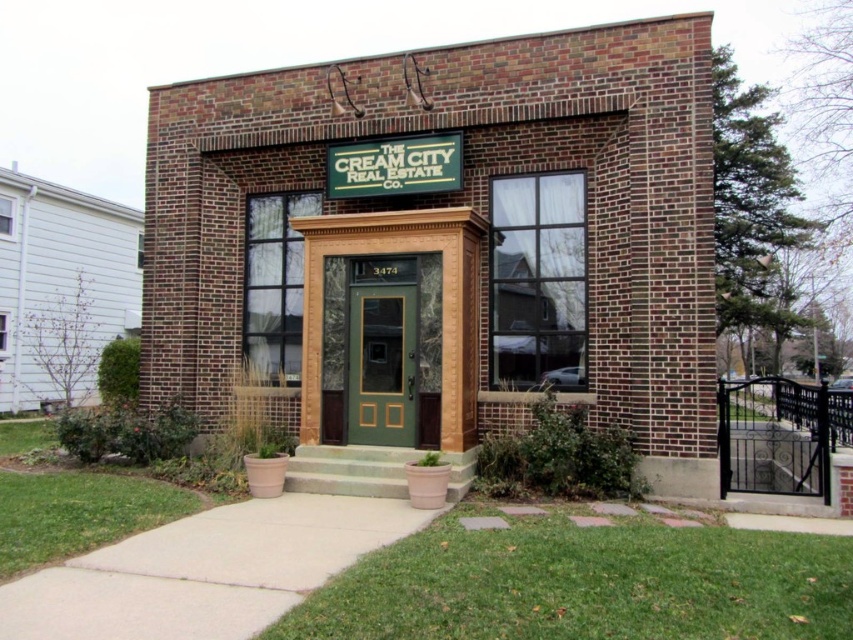
You are a delivery person trying to deliver a package to the green marble door at center and the green matte door at center. However, you notice that there are two doors with similar colors. How can you distinguish between the two doors?

The green marble door at center is much taller than the green matte door at center, so you can tell them apart by their height difference.

You are a delivery person with a package that requires a 10 cm clearance to pass through the entrance. You see the green marble door at center and the green matte door at center. Can you fit through the space between them?

The green marble door at center and the green matte door at center are 7.10 centimeters apart from each other. Since the required clearance is 10 cm, the package cannot fit through the space between them.